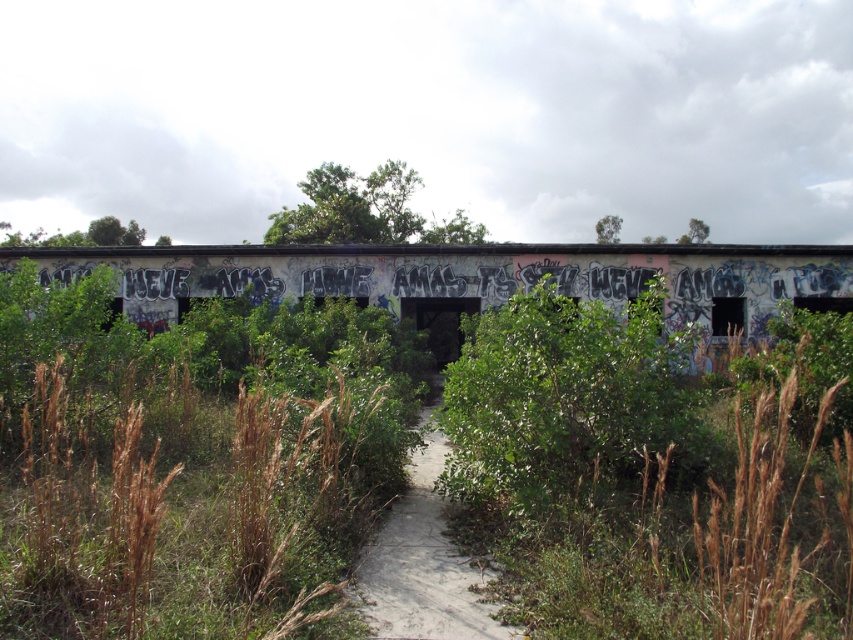
Based on the photo, which of these two, grungy concrete bridge at center or dirt path at center, stands taller?

grungy concrete bridge at center is taller.

From the picture: Between grungy concrete bridge at center and dirt path at center, which one appears on the left side from the viewer's perspective?

From the viewer's perspective, dirt path at center appears more on the left side.

Which is in front, point (432, 336) or point (404, 602)?

Point (404, 602) is more forward.

Identify the location of grungy concrete bridge at center. (463, 278).

Which is behind, point (544, 323) or point (364, 563)?

Positioned behind is point (544, 323).

Is green leafy bush at center thinner than dirt path at center?

No, green leafy bush at center is not thinner than dirt path at center.

Who is more distant from viewer, (514, 312) or (496, 608)?

The point (514, 312) is behind.

What are the coordinates of `green leafy bush at center` in the screenshot? It's located at (566, 401).

Between grungy concrete bridge at center and green leafy bush at center, which one is positioned higher?

grungy concrete bridge at center is above.

Does point (685, 275) come farther from viewer compared to point (624, 376)?

Yes, it is behind point (624, 376).

This screenshot has height=640, width=853. Identify the location of grungy concrete bridge at center. (463, 278).